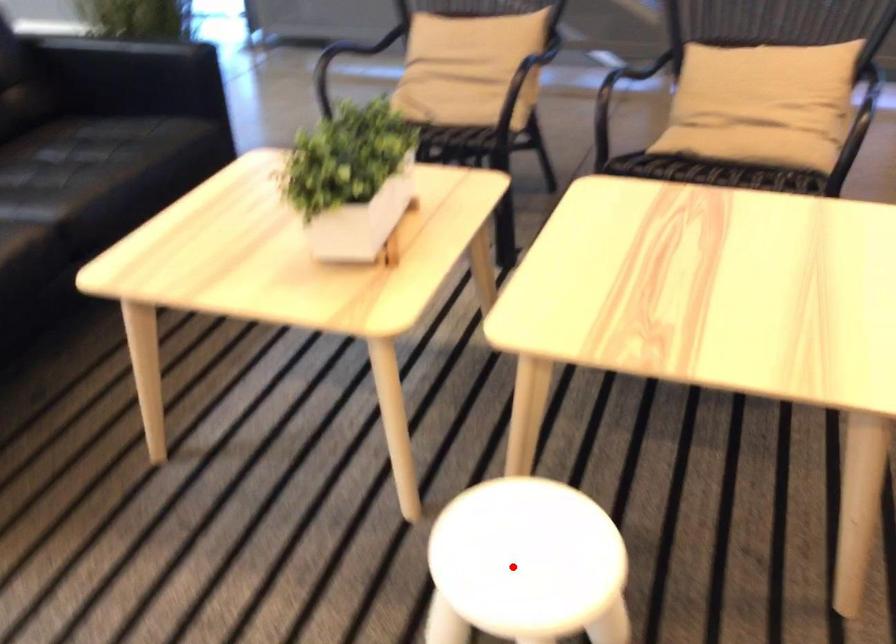
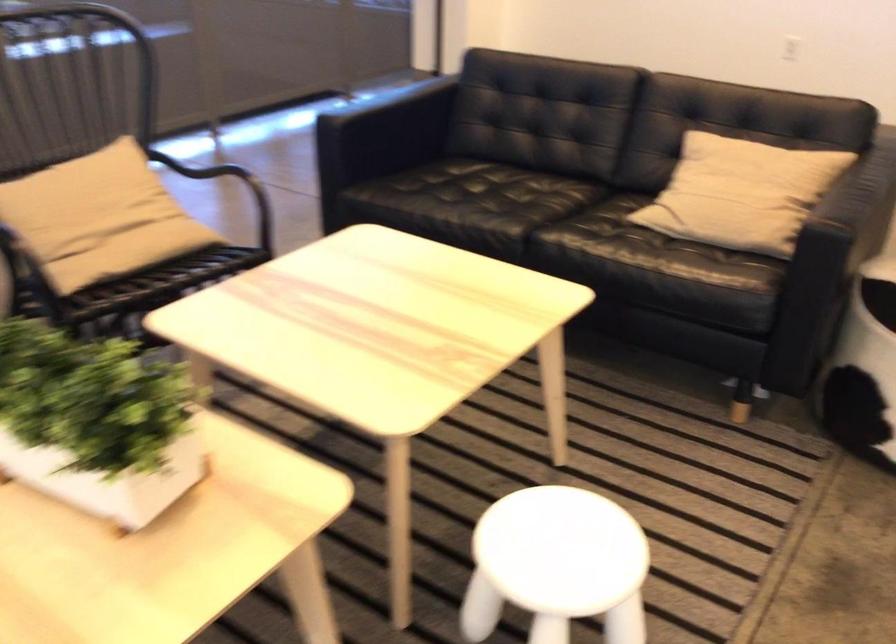
Question: I am providing you with two images of the same scene from different viewpoints. Image1 has a red point marked. In image2, the corresponding 3D location appears at what relative position? Reply with the corresponding letter.

Choices:
 (A) Closer
 (B) Farther

Answer: (B)